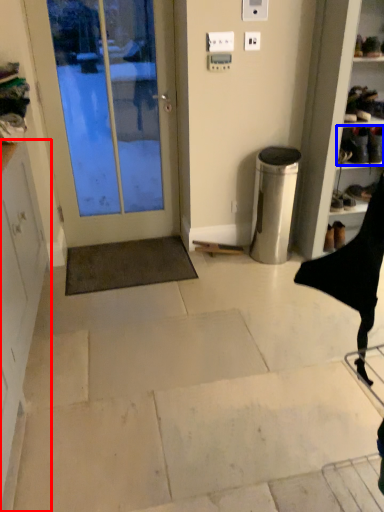
Question: Which of the following is the closest to the observer, cabinetry (highlighted by a red box) or footwear (highlighted by a blue box)?

Choices:
 (A) cabinetry
 (B) footwear

Answer: (A)